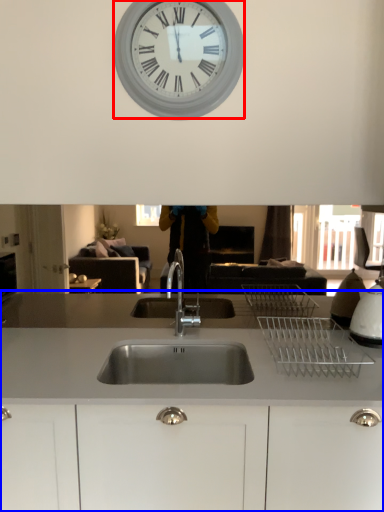
Question: Which object is closer to the camera taking this photo, wall clock (highlighted by a red box) or countertop (highlighted by a blue box)?

Choices:
 (A) wall clock
 (B) countertop

Answer: (B)